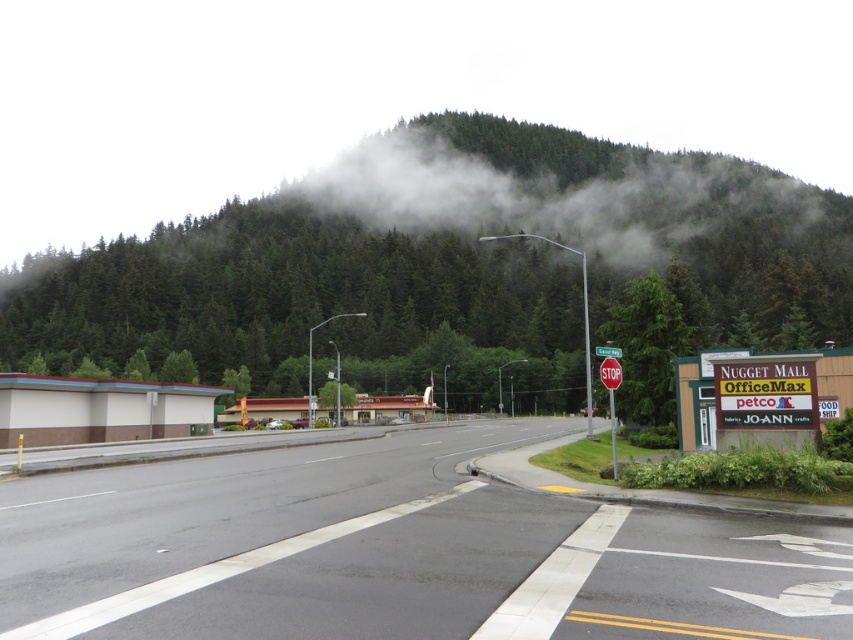
Question: From the image, what is the correct spatial relationship of green matte tree at center in relation to red plastic stop sign at center?

Choices:
 (A) right
 (B) left

Answer: (A)

Question: Is asphalt road at center to the right of green matte tree at center from the viewer's perspective?

Choices:
 (A) no
 (B) yes

Answer: (A)

Question: Which of the following is the farthest from the observer?

Choices:
 (A) red plastic stop sign at center
 (B) green leafy tree at upper center

Answer: (B)

Question: Is green matte tree at center to the right of red metallic stop sign at upper center from the viewer's perspective?

Choices:
 (A) yes
 (B) no

Answer: (A)

Question: Estimate the real-world distances between objects in this image. Which object is closer to the green leafy tree at upper center?

Choices:
 (A) red plastic stop sign at center
 (B) red metallic stop sign at upper center
 (C) asphalt road at center
 (D) green matte tree at center

Answer: (D)

Question: Which of the following is the farthest from the observer?

Choices:
 (A) green matte tree at center
 (B) asphalt road at center

Answer: (A)